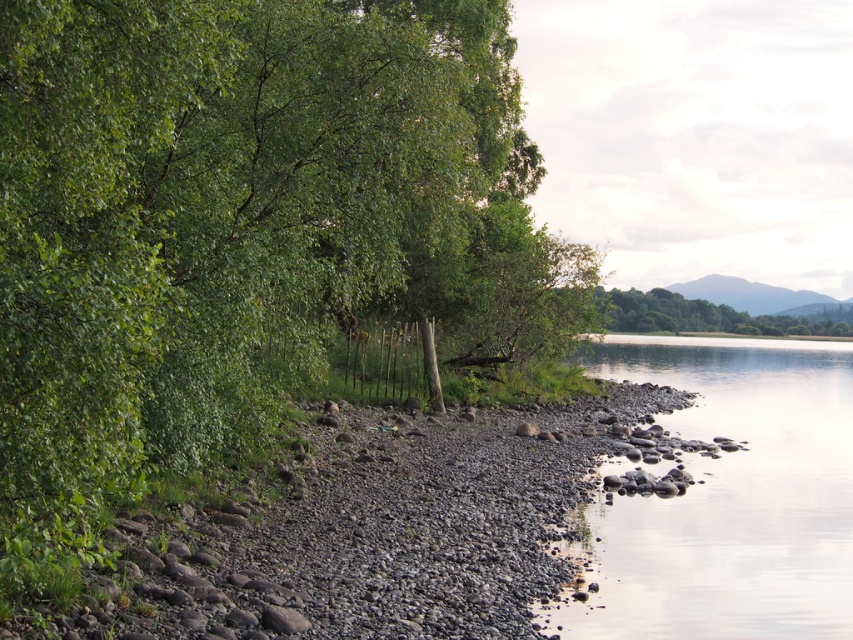
Between green leafy tree at left and smooth stone river at lower right, which one is positioned lower?

Positioned lower is smooth stone river at lower right.

How distant is green leafy tree at left from smooth stone river at lower right?

green leafy tree at left is 9.71 meters away from smooth stone river at lower right.

Is point (262, 362) behind point (602, 563)?

Yes.

Where is `green leafy tree at left`? green leafy tree at left is located at coordinates (235, 228).

From the picture: Does green leafy tree at left come behind green leafy tree at upper right?

No.

Does green leafy tree at left appear on the left side of green leafy tree at upper right?

Indeed, green leafy tree at left is positioned on the left side of green leafy tree at upper right.

Between point (55, 516) and point (635, 292), which one is positioned in front?

Point (55, 516)

Where is `green leafy tree at left`? Image resolution: width=853 pixels, height=640 pixels. green leafy tree at left is located at coordinates (235, 228).

Can you confirm if smooth gravel river bank at center is positioned to the left of green leafy tree at upper right?

Yes, smooth gravel river bank at center is to the left of green leafy tree at upper right.

Looking at this image, how far apart are smooth gravel river bank at center and green leafy tree at upper right?

smooth gravel river bank at center and green leafy tree at upper right are 117.86 feet apart from each other.

Who is more forward, (132, 612) or (726, 308)?

Point (132, 612)

Identify the location of smooth gravel river bank at center. (366, 532).